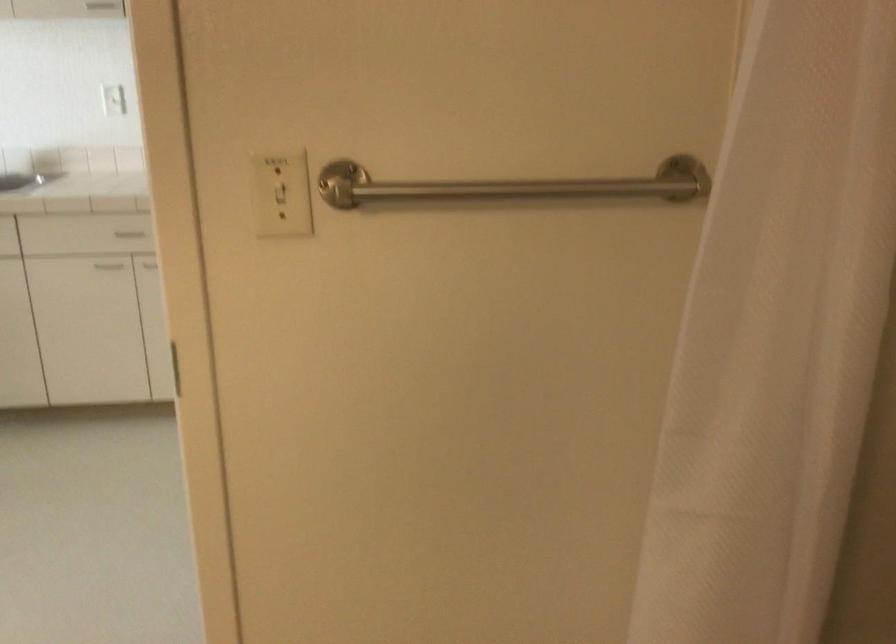
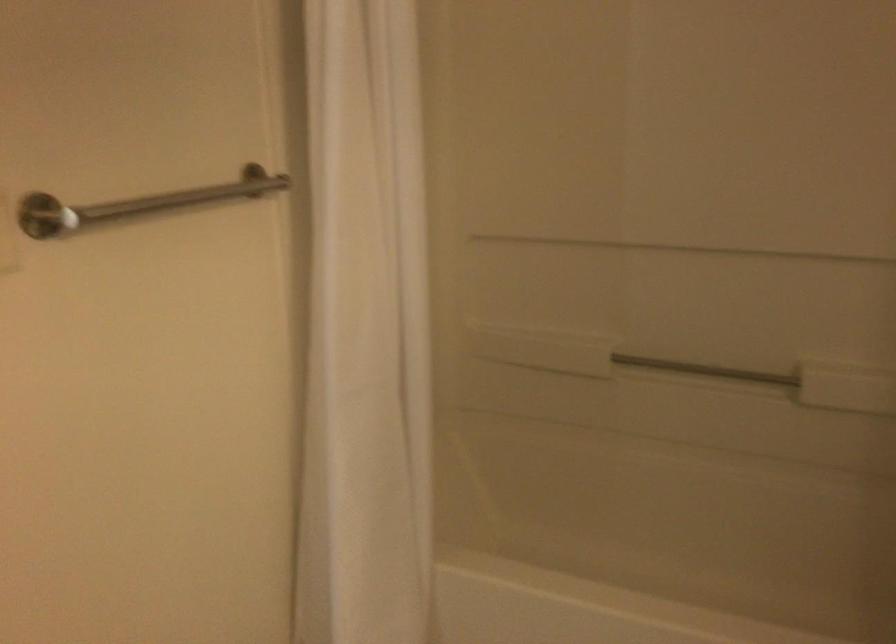
Find the pixel in the second image that matches [416,201] in the first image.

(138, 204)